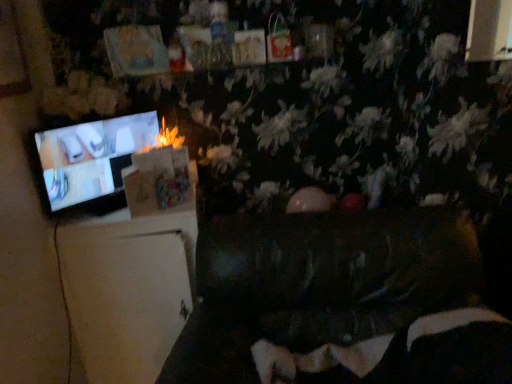
Question: From the image's perspective, would you say dark brown leather couch at center, marked as the 1th furniture in a right-to-left arrangement, is shown under matte black television at left?

Choices:
 (A) yes
 (B) no

Answer: (A)

Question: Is dark brown leather couch at center, marked as the 1th furniture in a right-to-left arrangement, to the left of matte black television at left from the viewer's perspective?

Choices:
 (A) yes
 (B) no

Answer: (B)

Question: Does dark brown leather couch at center, marked as the 1th furniture in a right-to-left arrangement, come behind matte black television at left?

Choices:
 (A) yes
 (B) no

Answer: (B)

Question: Can we say dark brown leather couch at center, marked as the 1th furniture in a right-to-left arrangement, lies outside matte black television at left?

Choices:
 (A) yes
 (B) no

Answer: (A)

Question: Is matte black television at left inside dark brown leather couch at center, marked as the 1th furniture in a right-to-left arrangement?

Choices:
 (A) yes
 (B) no

Answer: (B)

Question: Considering the positions of point (119, 339) and point (489, 327), is point (119, 339) closer or farther from the camera than point (489, 327)?

Choices:
 (A) farther
 (B) closer

Answer: (A)

Question: From a real-world perspective, is white matte refrigerator at left, arranged as the second furniture when viewed from the right, above or below velvet black bean bag chair at lower center?

Choices:
 (A) below
 (B) above

Answer: (A)

Question: From the image's perspective, is white matte refrigerator at left, placed as the 1th furniture when sorted from left to right, positioned above or below velvet black bean bag chair at lower center?

Choices:
 (A) above
 (B) below

Answer: (A)

Question: Is white matte refrigerator at left, arranged as the second furniture when viewed from the right, taller or shorter than velvet black bean bag chair at lower center?

Choices:
 (A) short
 (B) tall

Answer: (B)

Question: In the image, is matte black television at left on the left side or the right side of white matte refrigerator at left, arranged as the second furniture when viewed from the right?

Choices:
 (A) left
 (B) right

Answer: (A)

Question: In terms of width, does matte black television at left look wider or thinner when compared to white matte refrigerator at left, arranged as the second furniture when viewed from the right?

Choices:
 (A) wide
 (B) thin

Answer: (B)

Question: Does point (x=134, y=144) appear closer or farther from the camera than point (x=125, y=342)?

Choices:
 (A) closer
 (B) farther

Answer: (B)

Question: Which is correct: matte black television at left is inside white matte refrigerator at left, placed as the 1th furniture when sorted from left to right, or outside of it?

Choices:
 (A) outside
 (B) inside

Answer: (A)

Question: From a real-world perspective, is dark brown leather couch at center, marked as the 1th furniture in a right-to-left arrangement, positioned above or below velvet black bean bag chair at lower center?

Choices:
 (A) above
 (B) below

Answer: (B)

Question: Is dark brown leather couch at center, the 2th furniture viewed from the left, taller or shorter than velvet black bean bag chair at lower center?

Choices:
 (A) tall
 (B) short

Answer: (A)